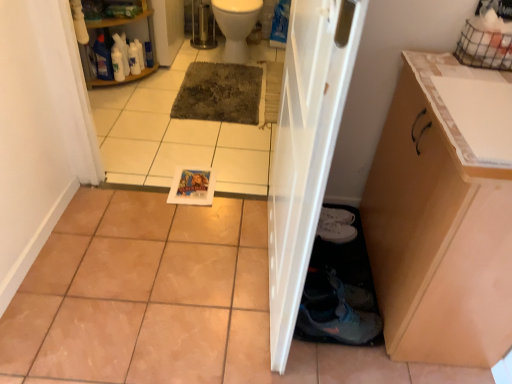
Question: Is gray textured mat at center directly adjacent to white tile at lower center?

Choices:
 (A) no
 (B) yes

Answer: (A)

Question: From a real-world perspective, does gray textured mat at center sit lower than white tile at lower center?

Choices:
 (A) no
 (B) yes

Answer: (B)

Question: Can you confirm if gray textured mat at center is positioned to the right of white tile at lower center?

Choices:
 (A) yes
 (B) no

Answer: (A)

Question: From the image's perspective, is gray textured mat at center over white tile at lower center?

Choices:
 (A) no
 (B) yes

Answer: (B)

Question: Is gray textured mat at center not near white tile at lower center?

Choices:
 (A) no
 (B) yes

Answer: (A)

Question: From a real-world perspective, does gray textured mat at center stand above white tile at lower center?

Choices:
 (A) no
 (B) yes

Answer: (A)

Question: From the image's perspective, would you say gray textured mat at center is positioned over white glossy toilet bowl at upper center?

Choices:
 (A) no
 (B) yes

Answer: (A)

Question: Are gray textured mat at center and white glossy toilet bowl at upper center making contact?

Choices:
 (A) yes
 (B) no

Answer: (B)

Question: Is gray textured mat at center far away from white glossy toilet bowl at upper center?

Choices:
 (A) yes
 (B) no

Answer: (B)

Question: Is gray textured mat at center smaller than white glossy toilet bowl at upper center?

Choices:
 (A) no
 (B) yes

Answer: (B)

Question: Is gray textured mat at center oriented away from white glossy toilet bowl at upper center?

Choices:
 (A) no
 (B) yes

Answer: (B)

Question: Is gray textured mat at center positioned beyond the bounds of white glossy toilet bowl at upper center?

Choices:
 (A) yes
 (B) no

Answer: (A)

Question: Does gray textured mat at center have a smaller size compared to white plastic shelf at upper left?

Choices:
 (A) yes
 (B) no

Answer: (A)